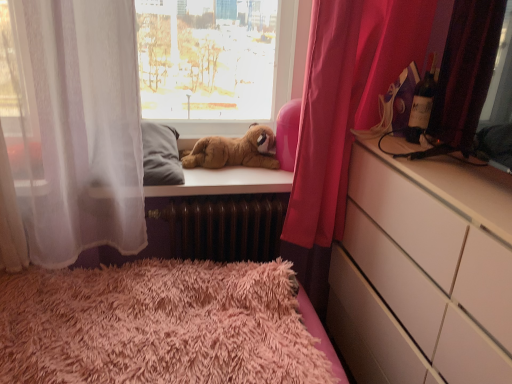
Question: From the image's perspective, relative to matte glass bottle at right, is white glossy chest of drawers at right above or below?

Choices:
 (A) above
 (B) below

Answer: (B)

Question: Is white glossy chest of drawers at right taller or shorter than matte glass bottle at right?

Choices:
 (A) tall
 (B) short

Answer: (A)

Question: Which object is the farthest from the matte glass bottle at right?

Choices:
 (A) white glossy chest of drawers at right
 (B) brown plush bear at upper center
 (C) pink fabric curtain at right, acting as the second curtain starting from the front
 (D) velvet dark red curtain at right, acting as the first curtain starting from the front

Answer: (B)

Question: Which object is positioned closest to the brown plush bear at upper center?

Choices:
 (A) matte glass bottle at right
 (B) white glossy chest of drawers at right
 (C) pink fabric curtain at right, which is the 1th curtain in back-to-front order
 (D) velvet dark red curtain at right, marked as the second curtain in a back-to-front arrangement

Answer: (C)